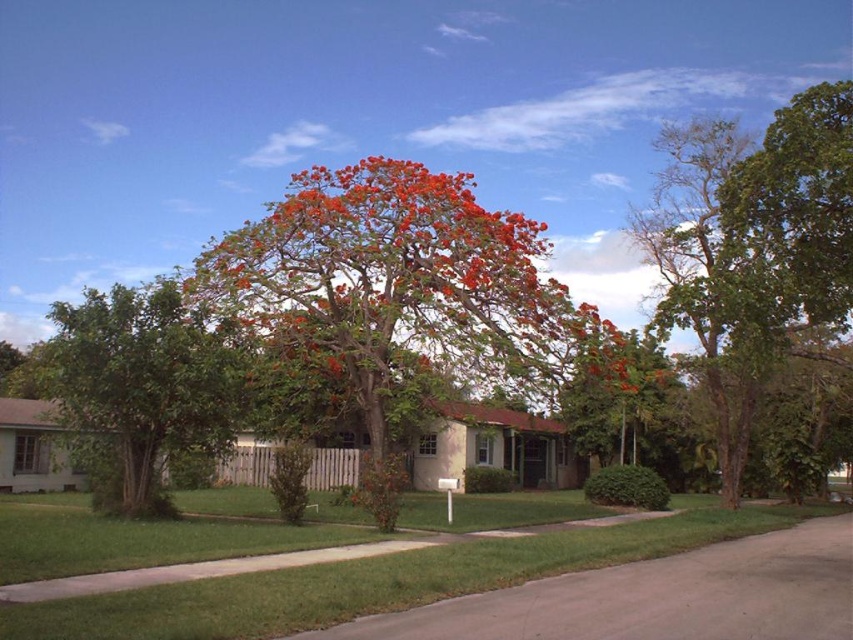
Which is behind, point (85, 632) or point (207, 355)?

The point (207, 355) is more distant.

Is point (596, 548) closer to camera compared to point (51, 365)?

Yes, it is in front of point (51, 365).

This screenshot has height=640, width=853. Find the location of `green grass at center`. green grass at center is located at coordinates (378, 580).

This screenshot has height=640, width=853. Find the location of `green grass at center`. green grass at center is located at coordinates (378, 580).

Which is above, bright orange blossoms at center or green leafy tree at right?

green leafy tree at right is above.

Consider the image. Who is taller, bright orange blossoms at center or green leafy tree at right?

green leafy tree at right

Does point (318, 328) come closer to viewer compared to point (846, 124)?

No, (318, 328) is behind (846, 124).

Image resolution: width=853 pixels, height=640 pixels. Find the location of `bright orange blossoms at center`. bright orange blossoms at center is located at coordinates (393, 294).

Is bright orange blossoms at center taller than orange leafy tree at center?

Indeed, bright orange blossoms at center has a greater height compared to orange leafy tree at center.

Locate an element on the screen. The image size is (853, 640). bright orange blossoms at center is located at coordinates (393, 294).